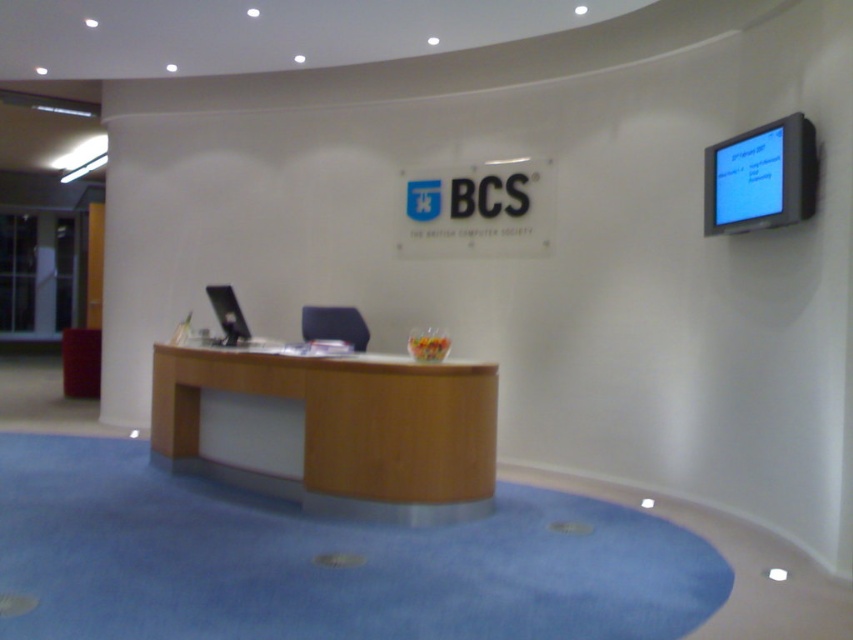
You are standing at the entrance of the office and see two points marked on the wall. The first point is at coordinate point(354, 509) and the second is at point(538, 170). Which point is closer to you?

Point(354, 509) is in front of point(538, 170), so it is closer to you.

You are planning to place a new decorative item on the woodendesk at center and the white matte sign at center. Which surface has more space available for placing items?

The woodendesk at center has more space available for placing items because it is larger in size than the white matte sign at center.